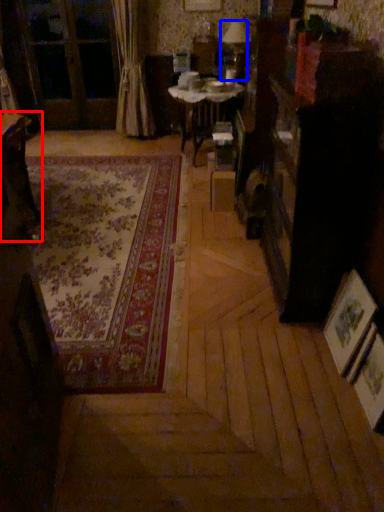
Question: Among these objects, which one is nearest to the camera, table (highlighted by a red box) or table lamp (highlighted by a blue box)?

Choices:
 (A) table
 (B) table lamp

Answer: (A)